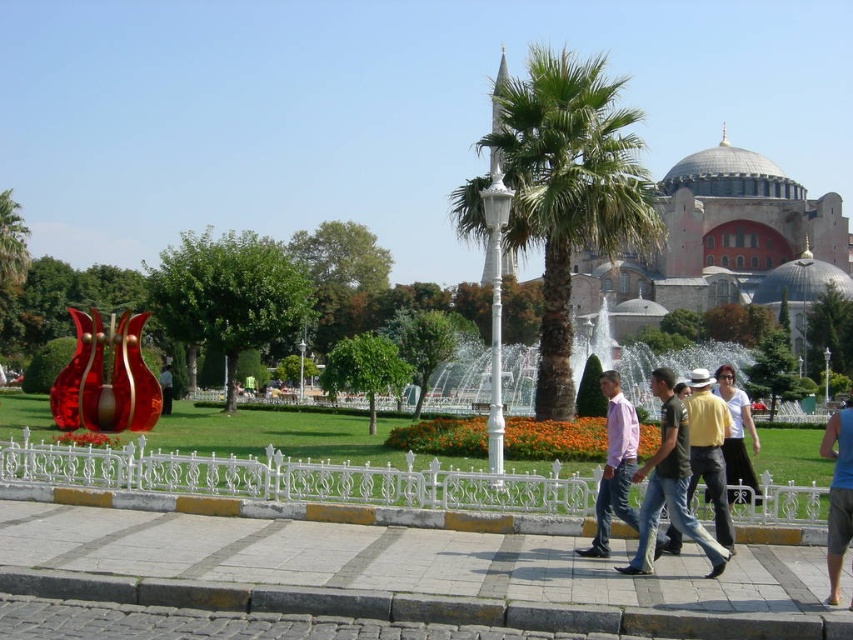
Who is positioned more to the right, cobblestone pavement at center or white cotton shirt at center?

white cotton shirt at center

Who is more distant from viewer, (733, 625) or (727, 477)?

The point (727, 477) is behind.

What are the coordinates of `cobblestone pavement at center` in the screenshot? It's located at (408, 573).

Which of these two, light pink cotton shirt at center or blue fabric shorts at lower right, stands taller?

Standing taller between the two is light pink cotton shirt at center.

Is point (647, 552) positioned in front of point (833, 536)?

No.

The width and height of the screenshot is (853, 640). What are the coordinates of `light pink cotton shirt at center` in the screenshot? It's located at (682, 481).

Is green leafy palm tree at center smaller than white cotton shirt at center?

Incorrect, green leafy palm tree at center is not smaller in size than white cotton shirt at center.

Can you confirm if green leafy palm tree at center is positioned to the right of white cotton shirt at center?

No, green leafy palm tree at center is not to the right of white cotton shirt at center.

Locate an element on the screen. The image size is (853, 640). green leafy palm tree at center is located at coordinates click(567, 189).